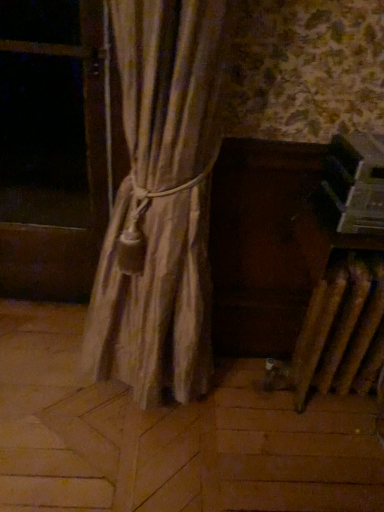
What do you see at coordinates (161, 202) in the screenshot? This screenshot has height=512, width=384. I see `textured beige curtain at center` at bounding box center [161, 202].

You are a GUI agent. You are given a task and a screenshot of the screen. Output one action in this format:
    pyautogui.click(x=<x>, y=<y>)
    Task: Click on the textured beige curtain at center
    
    Given the screenshot: What is the action you would take?
    pyautogui.click(x=161, y=202)

In the scene shown: What is the approximate width of transparent plastic window screen at left?

transparent plastic window screen at left is 2.73 inches wide.

Measure the distance between transparent plastic window screen at left and camera.

The distance of transparent plastic window screen at left from camera is 3.16 meters.

The width and height of the screenshot is (384, 512). Describe the element at coordinates (42, 140) in the screenshot. I see `transparent plastic window screen at left` at that location.

This screenshot has height=512, width=384. I want to click on transparent plastic window screen at left, so click(x=42, y=140).

Identify the location of textured beige curtain at center. (161, 202).

Which object is positioned more to the left, textured beige curtain at center or transparent plastic window screen at left?

From the viewer's perspective, transparent plastic window screen at left appears more on the left side.

Considering the positions of objects textured beige curtain at center and transparent plastic window screen at left in the image provided, who is behind, textured beige curtain at center or transparent plastic window screen at left?

transparent plastic window screen at left.

Which point is more distant from viewer, (x=172, y=42) or (x=48, y=142)?

The point (x=48, y=142) is farther from the camera.

From the image's perspective, which is below, textured beige curtain at center or transparent plastic window screen at left?

textured beige curtain at center.

From a real-world perspective, is textured beige curtain at center below transparent plastic window screen at left?

No, from a real-world perspective, textured beige curtain at center is not below transparent plastic window screen at left.

Between textured beige curtain at center and transparent plastic window screen at left, which one has larger width?

textured beige curtain at center.

Considering the relative sizes of textured beige curtain at center and transparent plastic window screen at left in the image provided, is textured beige curtain at center shorter than transparent plastic window screen at left?

No.

Is textured beige curtain at center bigger or smaller than transparent plastic window screen at left?

In the image, textured beige curtain at center appears to be larger than transparent plastic window screen at left.

Do you think textured beige curtain at center is within transparent plastic window screen at left, or outside of it?

textured beige curtain at center is outside transparent plastic window screen at left.

Is textured beige curtain at center placed right next to transparent plastic window screen at left?

No, textured beige curtain at center is not with transparent plastic window screen at left.

Is textured beige curtain at center facing towards transparent plastic window screen at left?

No, textured beige curtain at center is not aimed at transparent plastic window screen at left.

What's the angular difference between textured beige curtain at center and transparent plastic window screen at left's facing directions?

The facing directions of textured beige curtain at center and transparent plastic window screen at left are 5.19 degrees apart.

Find the location of a particular element. window screen on the left of the textured beige curtain at center is located at coordinates tap(42, 140).

Considering the relative positions of transparent plastic window screen at left and textured beige curtain at center in the image provided, is transparent plastic window screen at left to the left or to the right of textured beige curtain at center?

Based on their positions, transparent plastic window screen at left is located to the left of textured beige curtain at center.

Is the position of transparent plastic window screen at left more distant than that of textured beige curtain at center?

Yes, transparent plastic window screen at left is behind textured beige curtain at center.

Considering the positions of points (46, 216) and (108, 284), is point (46, 216) closer to camera compared to point (108, 284)?

No, it is not.

From the image's perspective, is transparent plastic window screen at left positioned above or below textured beige curtain at center?

transparent plastic window screen at left is situated higher than textured beige curtain at center in the image.

From a real-world perspective, is transparent plastic window screen at left above or below textured beige curtain at center?

In terms of real-world spatial position, transparent plastic window screen at left is below textured beige curtain at center.

Between transparent plastic window screen at left and textured beige curtain at center, which one has larger width?

With larger width is textured beige curtain at center.

Considering the relative sizes of transparent plastic window screen at left and textured beige curtain at center in the image provided, is transparent plastic window screen at left shorter than textured beige curtain at center?

Indeed, transparent plastic window screen at left has a lesser height compared to textured beige curtain at center.

Looking at the image, does transparent plastic window screen at left seem bigger or smaller compared to textured beige curtain at center?

In the image, transparent plastic window screen at left appears to be smaller than textured beige curtain at center.

Would you say transparent plastic window screen at left is inside or outside textured beige curtain at center?

transparent plastic window screen at left is located beyond the bounds of textured beige curtain at center.

Is transparent plastic window screen at left touching textured beige curtain at center?

No, transparent plastic window screen at left is not touching textured beige curtain at center.

Is transparent plastic window screen at left oriented away from textured beige curtain at center?

transparent plastic window screen at left does not have its back to textured beige curtain at center.

Can you tell me how much transparent plastic window screen at left and textured beige curtain at center differ in facing direction?

The angle between the facing direction of transparent plastic window screen at left and the facing direction of textured beige curtain at center is 5.19 degrees.

At what (x,y) coordinates should I click in order to perform the action: click on curtain above the transparent plastic window screen at left (from a real-world perspective). Please return your answer as a coordinate pair (x, y). The width and height of the screenshot is (384, 512). Looking at the image, I should click on (161, 202).

Find the location of `window screen lying on the left of textured beige curtain at center`. window screen lying on the left of textured beige curtain at center is located at coordinates pyautogui.click(x=42, y=140).

At what (x,y) coordinates should I click in order to perform the action: click on curtain in front of the transparent plastic window screen at left. Please return your answer as a coordinate pair (x, y). The image size is (384, 512). Looking at the image, I should click on (161, 202).